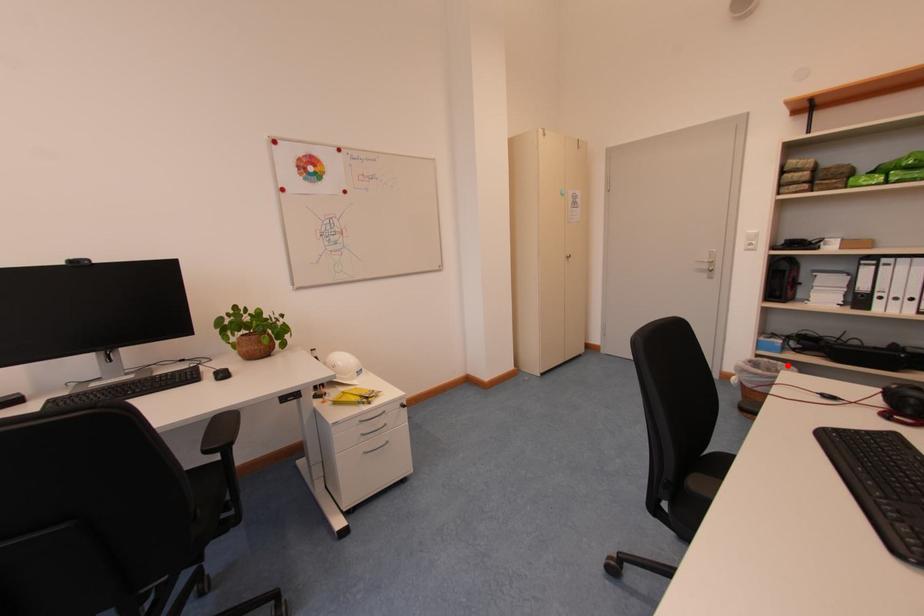
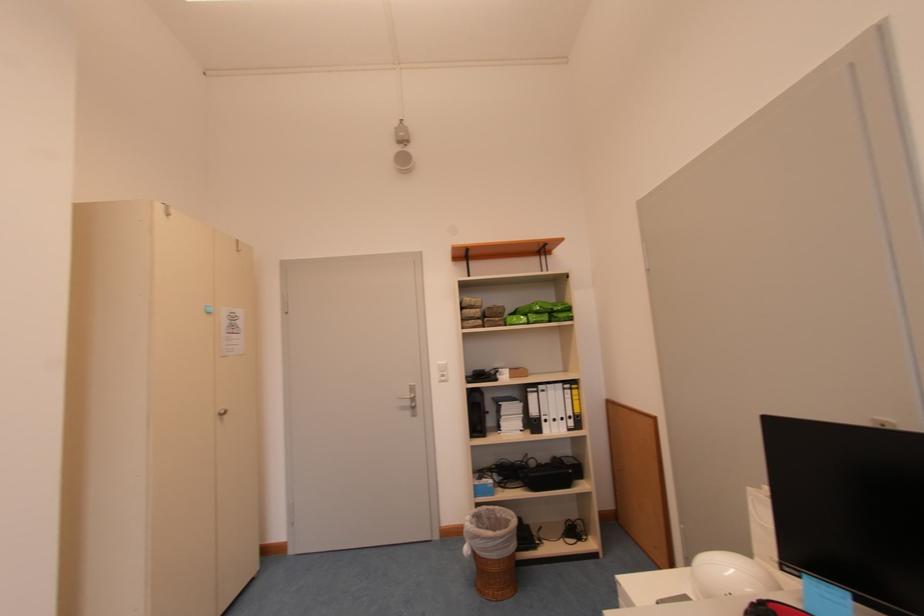
Locate, in the second image, the point that corresponds to the highlighted location in the first image.

(504, 509)